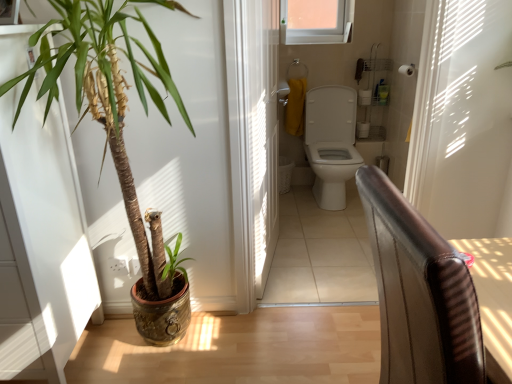
Question: Is white glossy toilet at center, the 1th path positioned from the top, at the right side of translucent plastic screen door at center?

Choices:
 (A) yes
 (B) no

Answer: (A)

Question: Does white glossy toilet at center, acting as the first path starting from the back, have a greater height compared to translucent plastic screen door at center?

Choices:
 (A) no
 (B) yes

Answer: (A)

Question: Is white glossy toilet at center, the 1th path positioned from the top, facing away from translucent plastic screen door at center?

Choices:
 (A) no
 (B) yes

Answer: (A)

Question: Considering the relative positions of white glossy toilet at center, the 2th path positioned from the bottom, and translucent plastic screen door at center in the image provided, is white glossy toilet at center, the 2th path positioned from the bottom, behind translucent plastic screen door at center?

Choices:
 (A) no
 (B) yes

Answer: (B)

Question: Is white glossy toilet at center, the 1th path positioned from the top, positioned beyond the bounds of translucent plastic screen door at center?

Choices:
 (A) no
 (B) yes

Answer: (B)

Question: From the image's perspective, is white glossy toilet at center, acting as the first path starting from the back, under translucent plastic screen door at center?

Choices:
 (A) no
 (B) yes

Answer: (B)

Question: From a real-world perspective, is white plastic towel bar at upper center on green leafy plant at left?

Choices:
 (A) no
 (B) yes

Answer: (B)

Question: From the image's perspective, is white plastic towel bar at upper center below green leafy plant at left?

Choices:
 (A) yes
 (B) no

Answer: (B)

Question: From a real-world perspective, is white plastic towel bar at upper center under green leafy plant at left?

Choices:
 (A) no
 (B) yes

Answer: (A)

Question: Can you confirm if white plastic towel bar at upper center is smaller than green leafy plant at left?

Choices:
 (A) no
 (B) yes

Answer: (B)

Question: Is white plastic towel bar at upper center located outside green leafy plant at left?

Choices:
 (A) no
 (B) yes

Answer: (B)

Question: Can you confirm if white plastic towel bar at upper center is taller than green leafy plant at left?

Choices:
 (A) yes
 (B) no

Answer: (B)

Question: Is wooden floor at lower left, marked as the 1th path in a bottom-to-top arrangement, closer to camera compared to white glossy toilet at center, the 1th path positioned from the top?

Choices:
 (A) no
 (B) yes

Answer: (B)